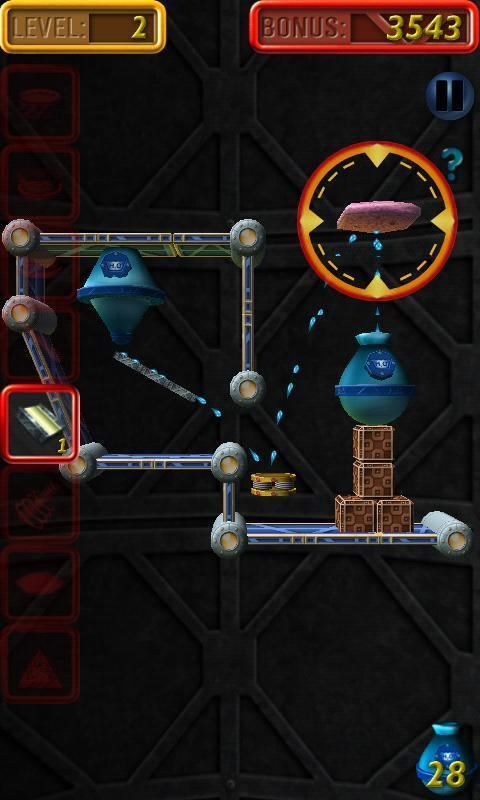
At what (x,y) coordinates should I click in order to perform the action: click on gap between walls. Please return your answer as a coordinate pair (x, y). The width and height of the screenshot is (480, 800). Looking at the image, I should click on (152, 522).